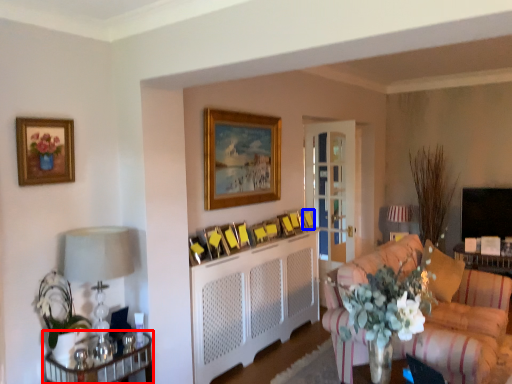
Question: Which object is further to the camera taking this photo, table (highlighted by a red box) or picture frame (highlighted by a blue box)?

Choices:
 (A) table
 (B) picture frame

Answer: (B)